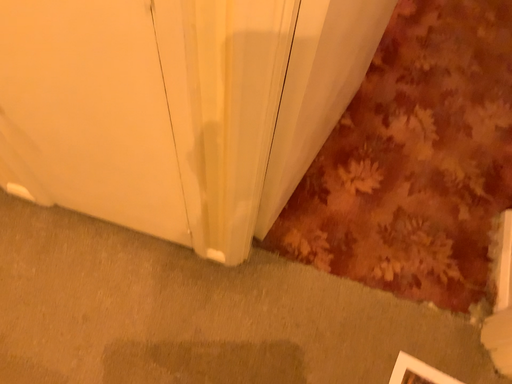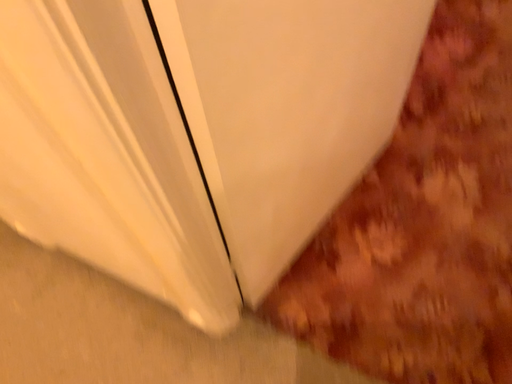
Question: How did the camera likely rotate when shooting the video?

Choices:
 (A) rotated left
 (B) rotated right

Answer: (A)